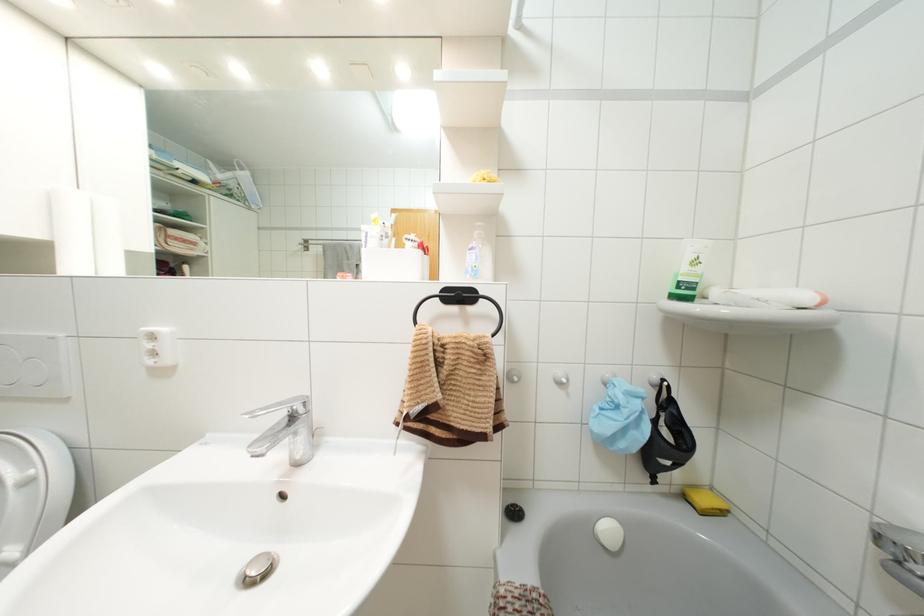
Which object does [706,501] point to?

It refers to a yellow sponge.